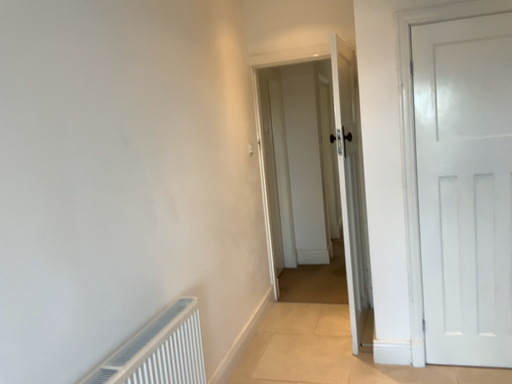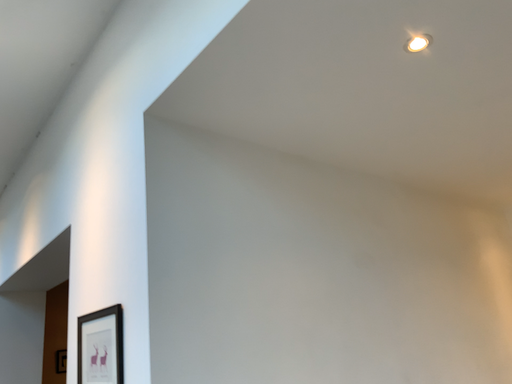
Question: Which way did the camera rotate in the video?

Choices:
 (A) rotated downward
 (B) rotated upward

Answer: (B)